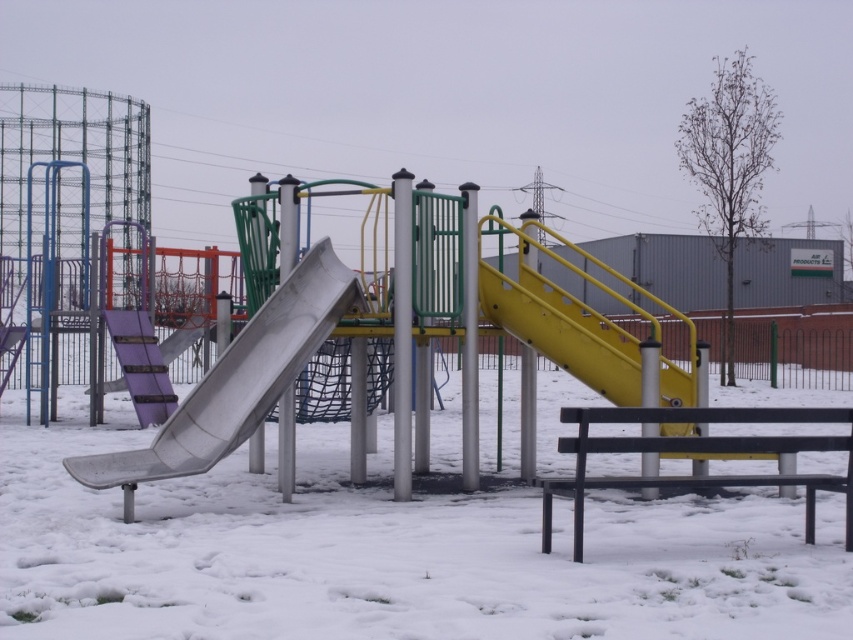
You are a parent trying to decide whether to let your child play on the metallic smooth slide at center. You notice the white fluffy snow at center nearby. Which direction from the slide should you check for snow accumulation to ensure safety?

The white fluffy snow at center is to the right of the metallic smooth slide at center, so you should check the right side of the slide for snow accumulation to ensure safety.

You are a parent trying to decide where to place a new small toy on the playground. You have a choice between placing it on the white fluffy snow at center or the metallic smooth slide at center. Which surface would you choose if you want the toy to be more visible to children playing nearby?

The white fluffy snow at center is larger in size than the metallic smooth slide at center, so placing the toy on the larger surface of the white fluffy snow at center would make it more visible to children playing nearby.